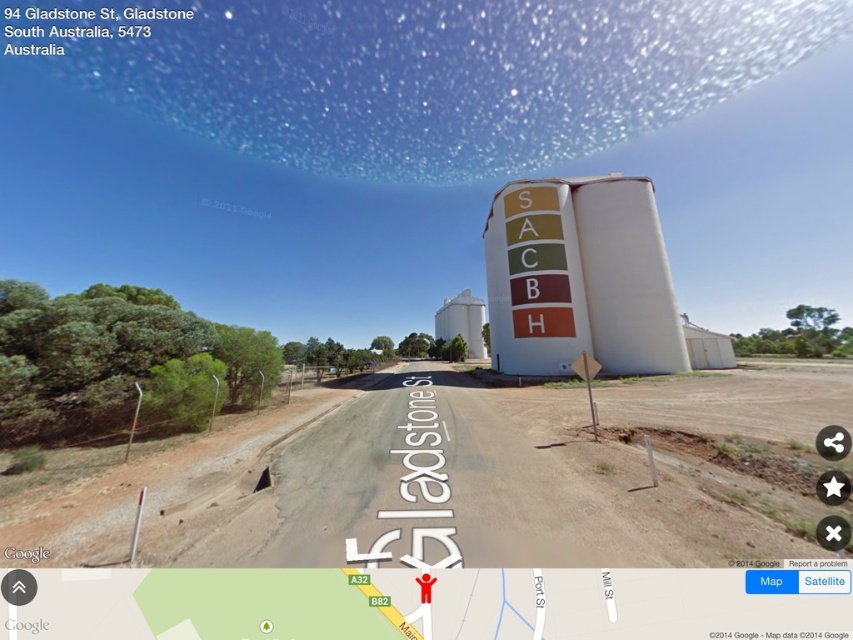
You are a delivery driver approaching the white matte water tower at center and the brown dirt track at lower left. Which one will you reach first?

The brown dirt track at lower left is closer to the viewer than the white matte water tower at center, so you will reach the brown dirt track at lower left first.

You are driving a car and want to park near the white matte silo at center. The brown dirt track at lower left is the only available parking spot. Is the parking spot located to the left of the silo?

Yes, the brown dirt track at lower left is to the left of white matte silo at center, so the parking spot is located to the left of the silo.

You are standing at the point labeled point (345, 528) and want to walk to point (471, 330). Given that both points are on the dirt road, which direction should you face to walk directly towards your destination?

Since point (345, 528) is closer to the camera than point 0.517, 0553, you should face away from the camera to walk directly towards your destination.